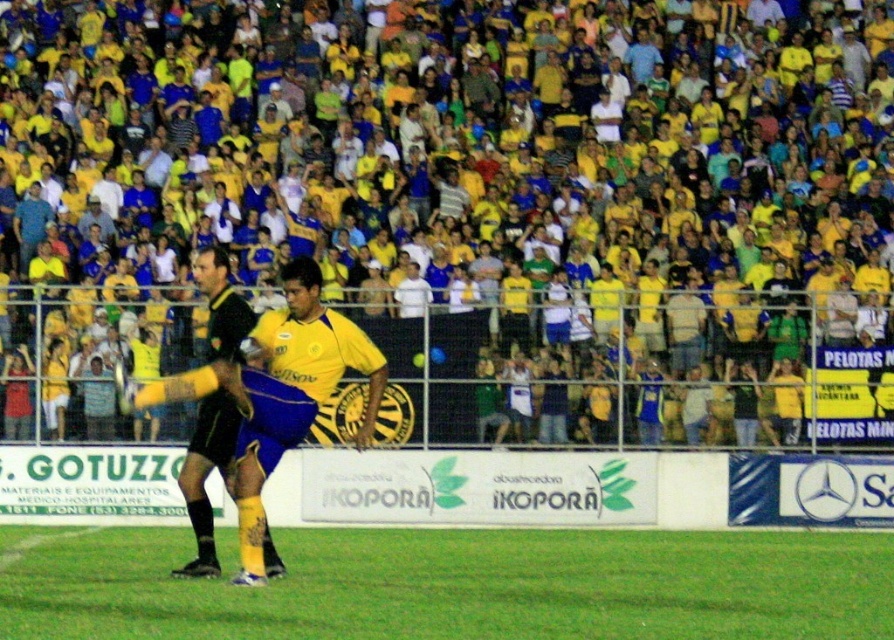
You are a soccer referee positioned at the center of the field. You notice two players wearing the yellow matte jersey at center and the black matte jersey at center. Which player is positioned to the right side from your perspective?

The yellow matte jersey at center is positioned to the right of the black matte jersey at center, so the player wearing the yellow matte jersey at center is to the right.